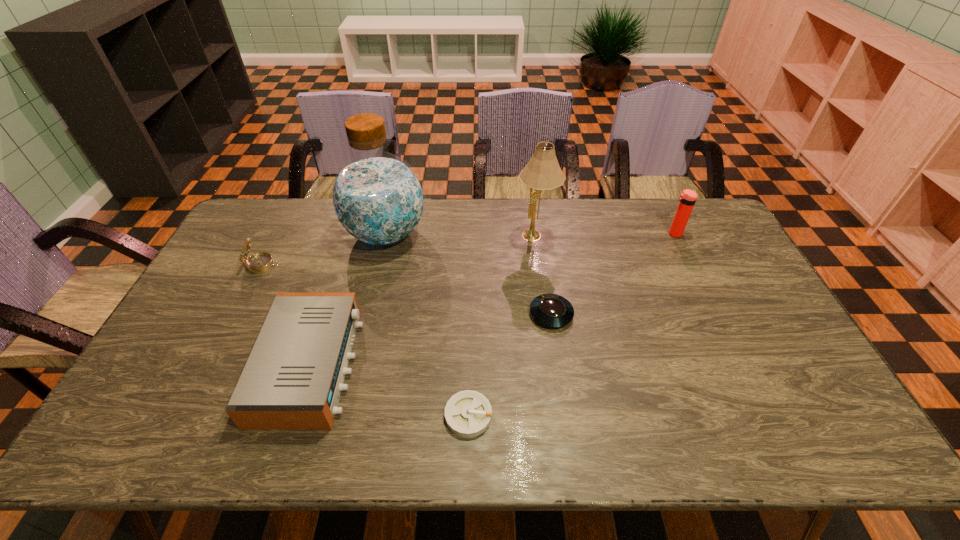
At what (x,y) coordinates should I click in order to perform the action: click on radio receiver present at the near edge. Please return your answer as a coordinate pair (x, y). The width and height of the screenshot is (960, 540). Looking at the image, I should click on (293, 378).

What are the coordinates of `ashtray situated at the near edge` in the screenshot? It's located at (468, 413).

What are the coordinates of `object that is at the left edge` in the screenshot? It's located at (260, 262).

Identify the location of object that is at the right edge. (687, 199).

The height and width of the screenshot is (540, 960). I want to click on object present at the far right corner, so click(x=687, y=199).

The width and height of the screenshot is (960, 540). I want to click on blank space at the far edge of the desktop, so click(420, 228).

Identify the location of vacant region at the near edge of the desktop. click(390, 427).

The height and width of the screenshot is (540, 960). What are the coordinates of `free space at the right edge of the desktop` in the screenshot? It's located at (724, 287).

I want to click on free space at the near right corner of the desktop, so click(x=848, y=429).

The height and width of the screenshot is (540, 960). Identify the location of free spot between the saucer and the water jug. (468, 274).